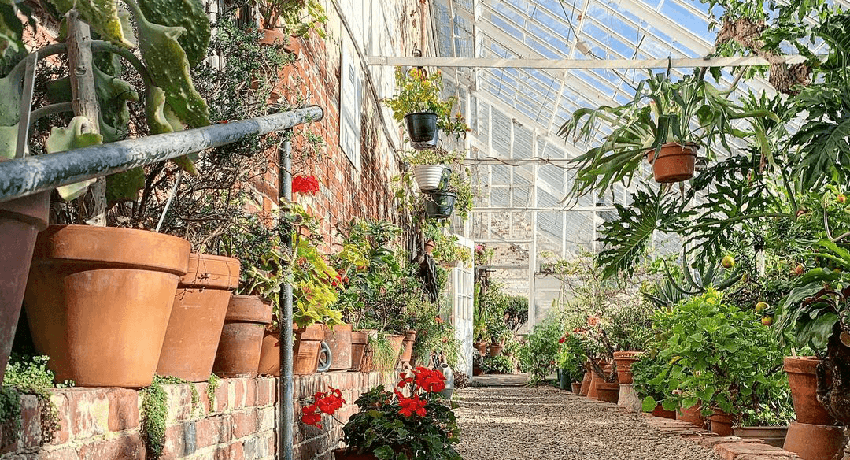
This screenshot has height=460, width=850. I want to click on hanging plastic pots, so click(422, 133), click(426, 180), click(437, 208), click(681, 163).